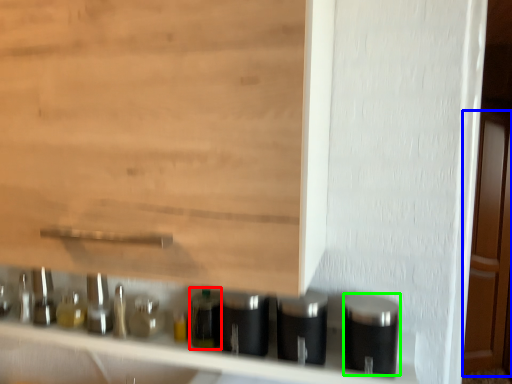
Question: Considering the real-world distances, which object is farthest from bottle (highlighted by a red box)? door (highlighted by a blue box) or silver (highlighted by a green box)?

Choices:
 (A) door
 (B) silver

Answer: (A)